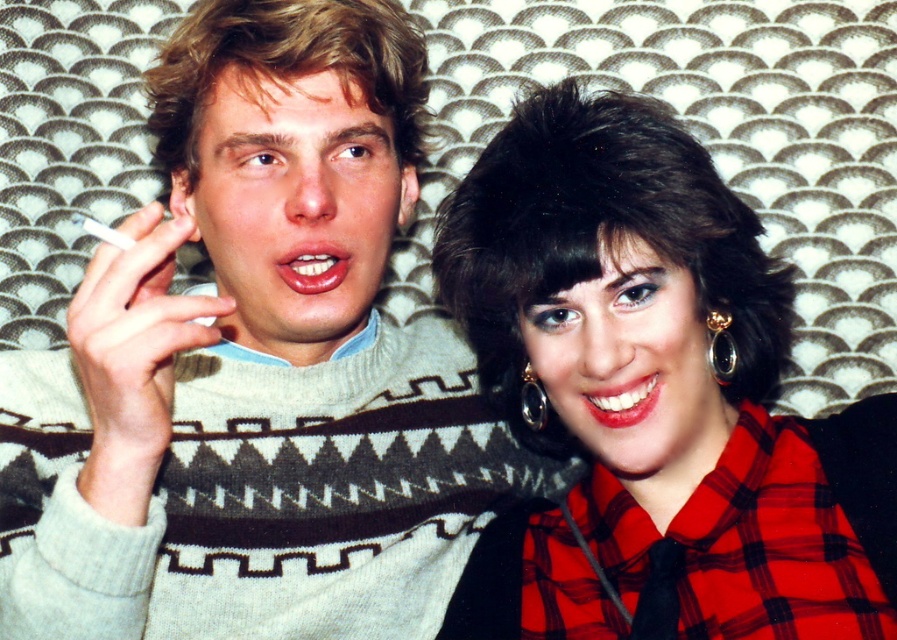
Question: Is gold metallic earring at upper right to the right of black shiny earring at upper right from the viewer's perspective?

Choices:
 (A) yes
 (B) no

Answer: (A)

Question: Does red plaid shirt at center have a larger size compared to gold metallic earring at upper right?

Choices:
 (A) no
 (B) yes

Answer: (B)

Question: Which object is positioned farthest from the red plaid shirt at center?

Choices:
 (A) gold metallic earring at upper right
 (B) black shiny earring at upper right

Answer: (B)

Question: Is gold metallic earring at upper right above black shiny earring at upper right?

Choices:
 (A) no
 (B) yes

Answer: (B)

Question: Which point is farther to the camera?

Choices:
 (A) (521, 580)
 (B) (545, 413)
 (C) (718, 310)

Answer: (A)

Question: Estimate the real-world distances between objects in this image. Which object is closer to the red plaid shirt at center?

Choices:
 (A) black shiny earring at upper right
 (B) gold metallic earring at upper right

Answer: (B)